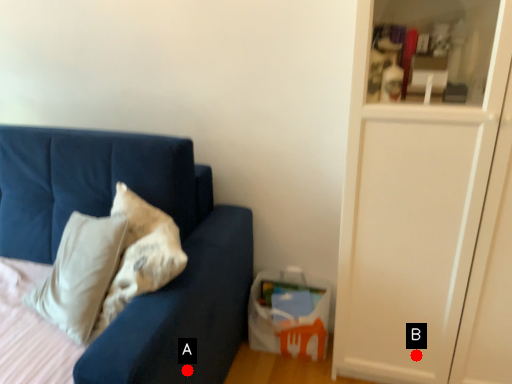
Question: Two points are circled on the image, labeled by A and B beside each circle. Which point is farther to the camera?

Choices:
 (A) A is further
 (B) B is further

Answer: (B)